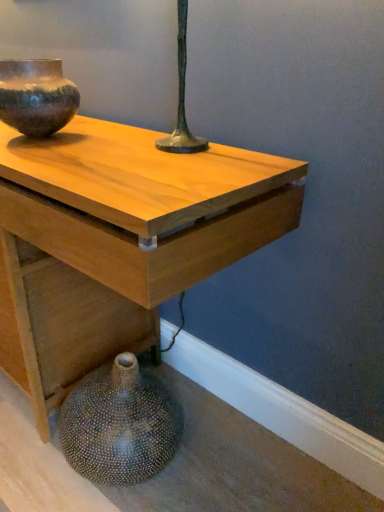
Question: Is speckled ceramic vase at lower left, the first vase when ordered from bottom to top, completely or partially outside of light wood table at center?

Choices:
 (A) no
 (B) yes

Answer: (A)

Question: Is speckled ceramic vase at lower left, the first vase when ordered from bottom to top, oriented towards light wood table at center?

Choices:
 (A) yes
 (B) no

Answer: (A)

Question: Considering the relative sizes of speckled ceramic vase at lower left, the first vase when ordered from bottom to top, and light wood table at center in the image provided, is speckled ceramic vase at lower left, the first vase when ordered from bottom to top, wider than light wood table at center?

Choices:
 (A) yes
 (B) no

Answer: (B)

Question: Are speckled ceramic vase at lower left, which is the 2th vase from top to bottom, and light wood table at center far apart?

Choices:
 (A) yes
 (B) no

Answer: (B)

Question: From a real-world perspective, is speckled ceramic vase at lower left, which is the 2th vase from top to bottom, positioned over light wood table at center based on gravity?

Choices:
 (A) no
 (B) yes

Answer: (A)

Question: From the image's perspective, is speckled ceramic vase at lower left, the first vase when ordered from bottom to top, on light wood table at center?

Choices:
 (A) no
 (B) yes

Answer: (A)

Question: Is speckled ceramic vase at lower left, which is the 2th vase from top to bottom, surrounding rustic ceramic vase at upper left, marked as the second vase in a bottom-to-top arrangement?

Choices:
 (A) no
 (B) yes

Answer: (A)

Question: Does speckled ceramic vase at lower left, which is the 2th vase from top to bottom, touch rustic ceramic vase at upper left, marked as the second vase in a bottom-to-top arrangement?

Choices:
 (A) no
 (B) yes

Answer: (A)

Question: Is speckled ceramic vase at lower left, the first vase when ordered from bottom to top, positioned beyond the bounds of rustic ceramic vase at upper left, positioned as the 1th vase in top-to-bottom order?

Choices:
 (A) yes
 (B) no

Answer: (A)

Question: Considering the relative sizes of speckled ceramic vase at lower left, which is the 2th vase from top to bottom, and rustic ceramic vase at upper left, marked as the second vase in a bottom-to-top arrangement, in the image provided, is speckled ceramic vase at lower left, which is the 2th vase from top to bottom, shorter than rustic ceramic vase at upper left, marked as the second vase in a bottom-to-top arrangement,?

Choices:
 (A) no
 (B) yes

Answer: (A)

Question: Is there a large distance between speckled ceramic vase at lower left, which is the 2th vase from top to bottom, and rustic ceramic vase at upper left, marked as the second vase in a bottom-to-top arrangement?

Choices:
 (A) yes
 (B) no

Answer: (B)

Question: From the image's perspective, does speckled ceramic vase at lower left, the first vase when ordered from bottom to top, appear lower than rustic ceramic vase at upper left, positioned as the 1th vase in top-to-bottom order?

Choices:
 (A) yes
 (B) no

Answer: (A)

Question: Does rustic ceramic vase at upper left, marked as the second vase in a bottom-to-top arrangement, have a lesser width compared to light wood table at center?

Choices:
 (A) no
 (B) yes

Answer: (B)